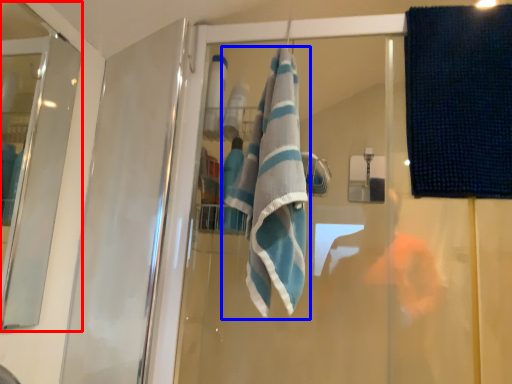
Question: Which object is further to the camera taking this photo, screen door (highlighted by a red box) or towel (highlighted by a blue box)?

Choices:
 (A) screen door
 (B) towel

Answer: (B)